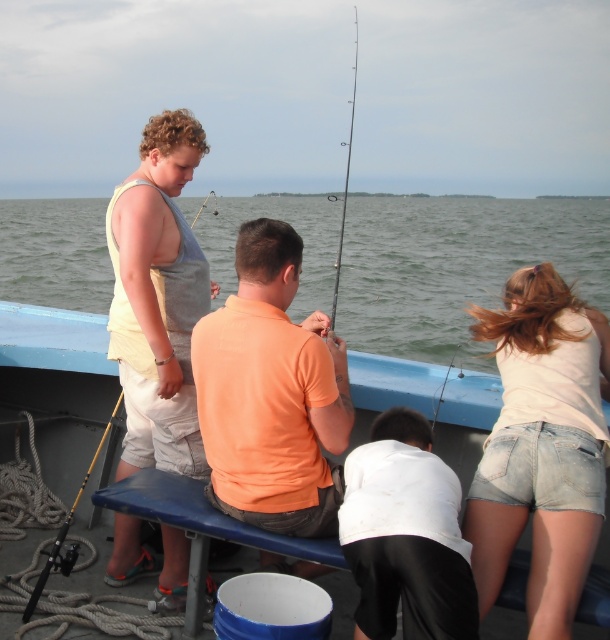
You are on a boat and need to reach two points marked on the deck. The first point is at coordinate point[140,346] and the second is at point[215,204]. Which point is closer to you?

Point[140,346] is closer to the viewer than point[215,204].

You are on a boat and need to retrieve an item. The item is located at one of two points on the boat. The first point is at coordinate point (318, 467) and the second is at point (361, 492). Which point is closer to you?

Point (318, 467) is closer to you because it is further to the viewer than point (361, 492).

You are standing at the center of the boat and want to pick up the yellow fiberglass fishing pole at lower left. Which direction should you move to reach it?

The yellow fiberglass fishing pole at lower left is located at point (65, 532), so you should move towards the lower left direction from the center to reach it.